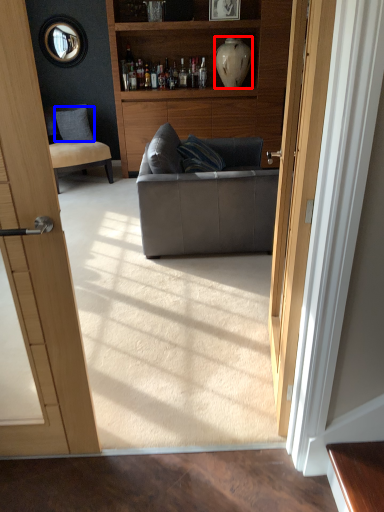
Question: Which object appears closest to the camera in this image, vase (highlighted by a red box) or pillow (highlighted by a blue box)?

Choices:
 (A) vase
 (B) pillow

Answer: (A)